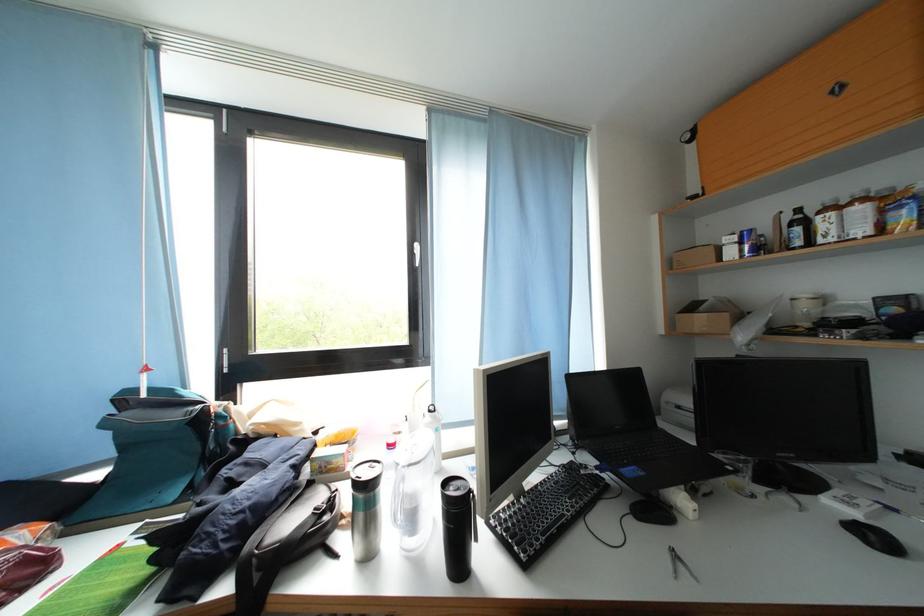
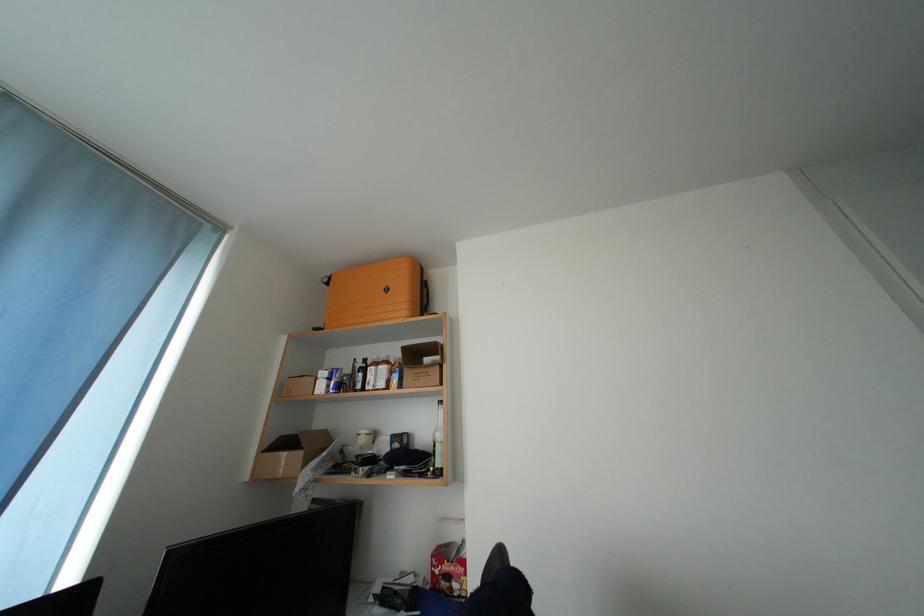
The images are taken continuously from a first-person perspective. In which direction is your viewpoint rotating?

The camera rotated toward right-up.